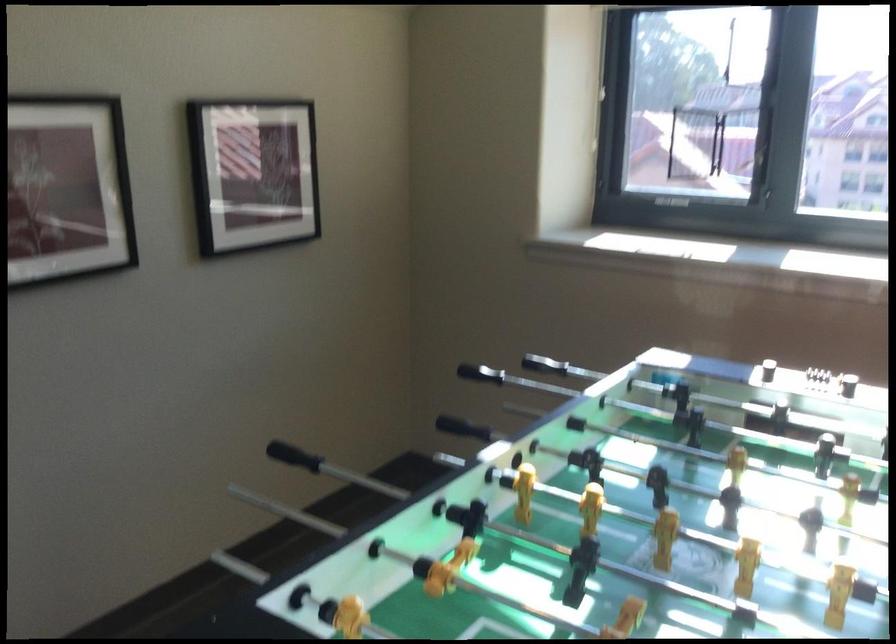
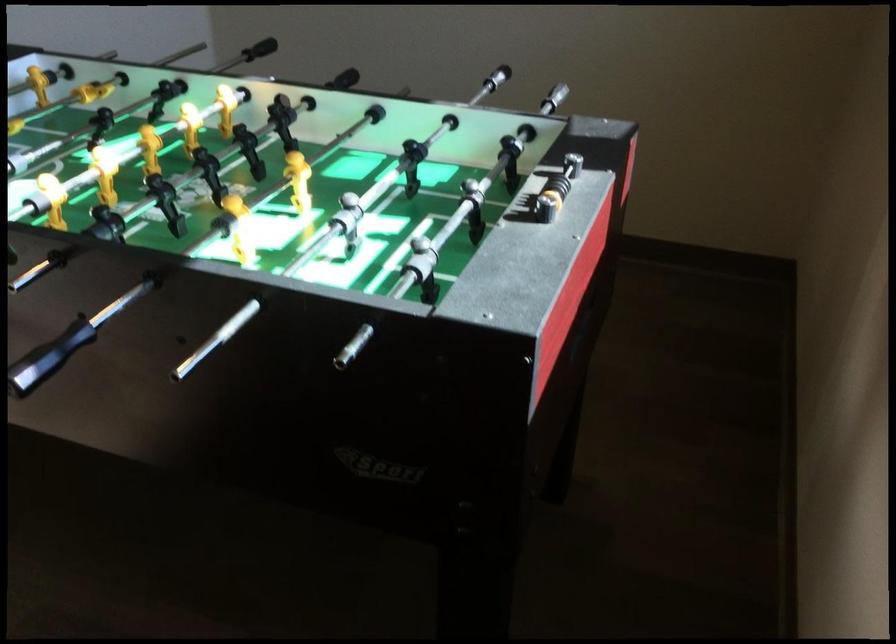
In the second image, find the point that corresponds to pixel 236 417 in the first image.

(554, 98)